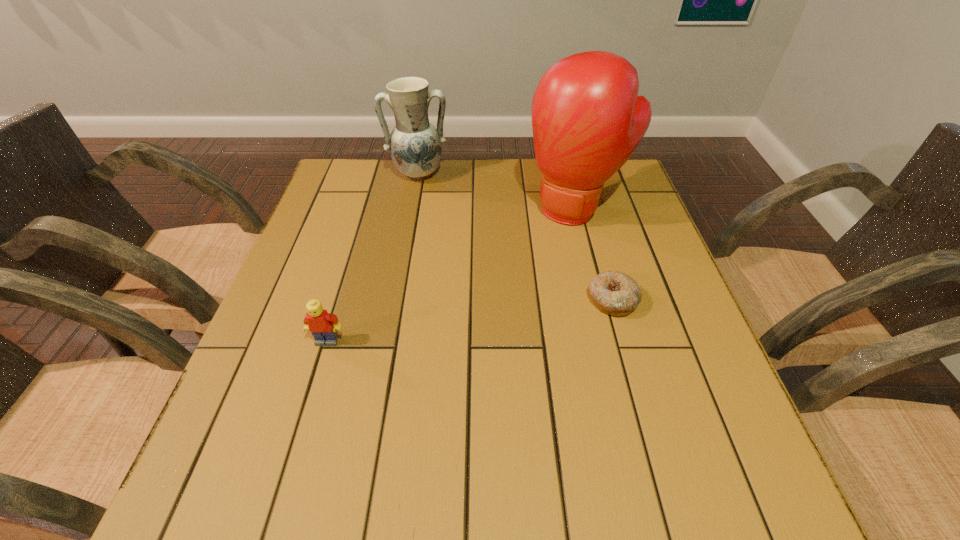
Locate an element on the screen. Image resolution: width=960 pixels, height=540 pixels. vacant area situated 0.350m on the striking surface of the tallest object is located at coordinates (494, 329).

Identify the location of free space located on either side of the pottery. (430, 259).

Find the location of `free point located 0.050m on either side of the pottery`. free point located 0.050m on either side of the pottery is located at coordinates (422, 197).

Locate an element on the screen. free space located on either side of the pottery is located at coordinates point(432,273).

Where is `boxing glove located at the far edge`? boxing glove located at the far edge is located at coordinates (587, 118).

Identify the location of pottery at the far edge. (415, 145).

Where is `object present at the left edge`? The image size is (960, 540). object present at the left edge is located at coordinates (322, 325).

Identify the location of doughnut at the right edge. (615, 293).

What are the coordinates of `boxing glove located at the right edge` in the screenshot? It's located at (587, 118).

I want to click on object present at the far right corner, so point(587,118).